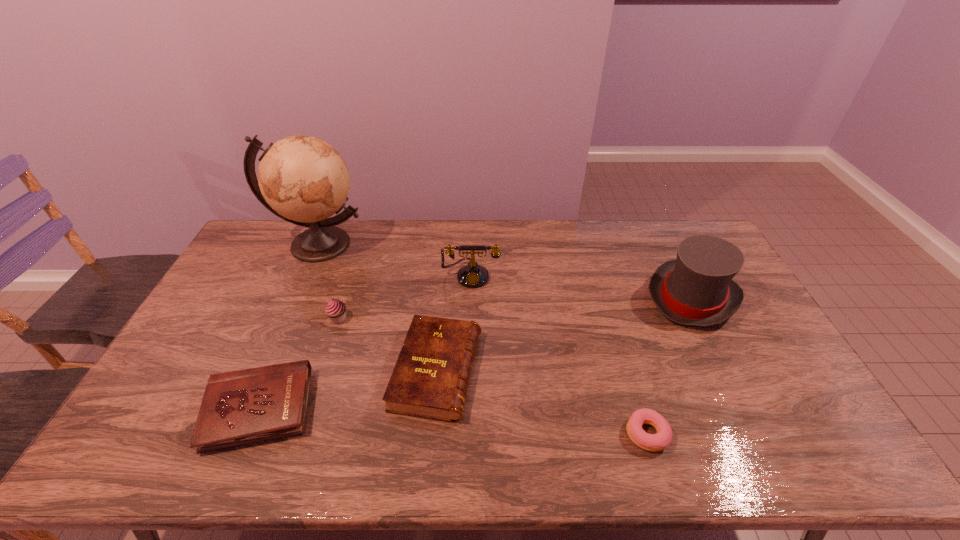
Identify the location of free space that satisfies the following two spatial constraints: 1. on the dial of the shortest object; 2. on the right side of the fifth shortest object. (468, 434).

The image size is (960, 540). Find the location of `vacant region that satisfies the following two spatial constraints: 1. on the front-facing side of the right hardback book; 2. on the left side of the tallest object`. vacant region that satisfies the following two spatial constraints: 1. on the front-facing side of the right hardback book; 2. on the left side of the tallest object is located at coordinates (263, 371).